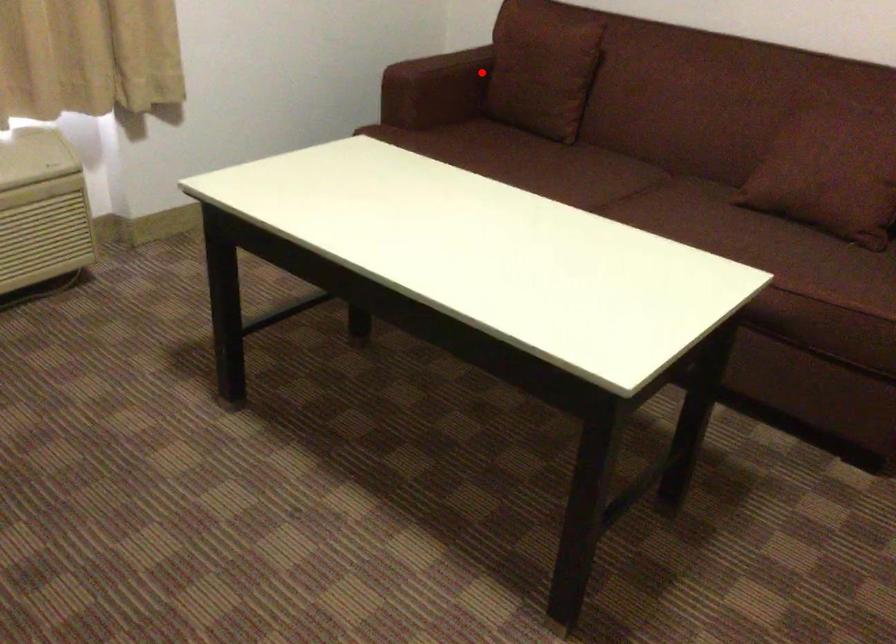
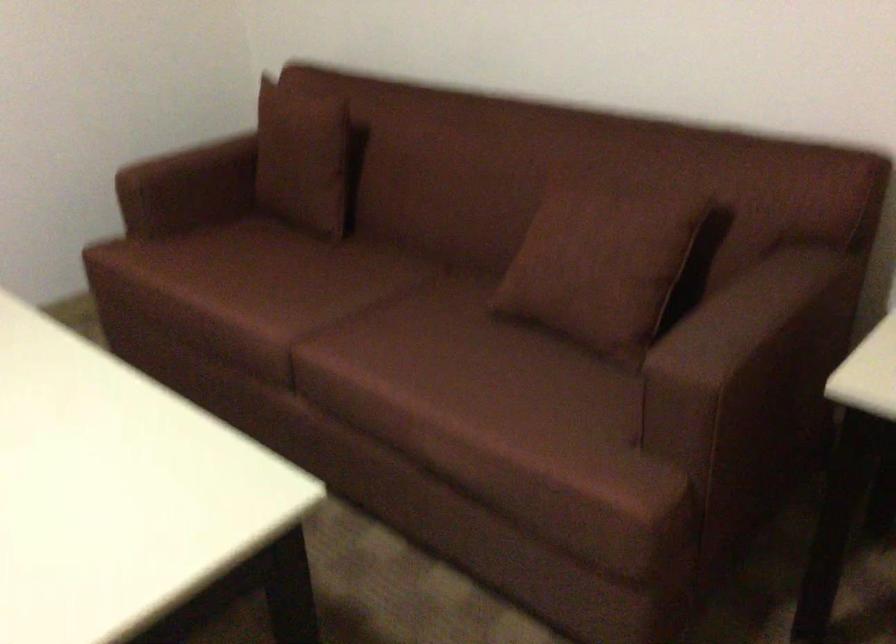
Question: I am providing you with two images of the same scene from different viewpoints. In image1, a red point is highlighted. Considering the same 3D point in image2, which of the following is correct?

Choices:
 (A) It is closer
 (B) It is farther

Answer: (A)